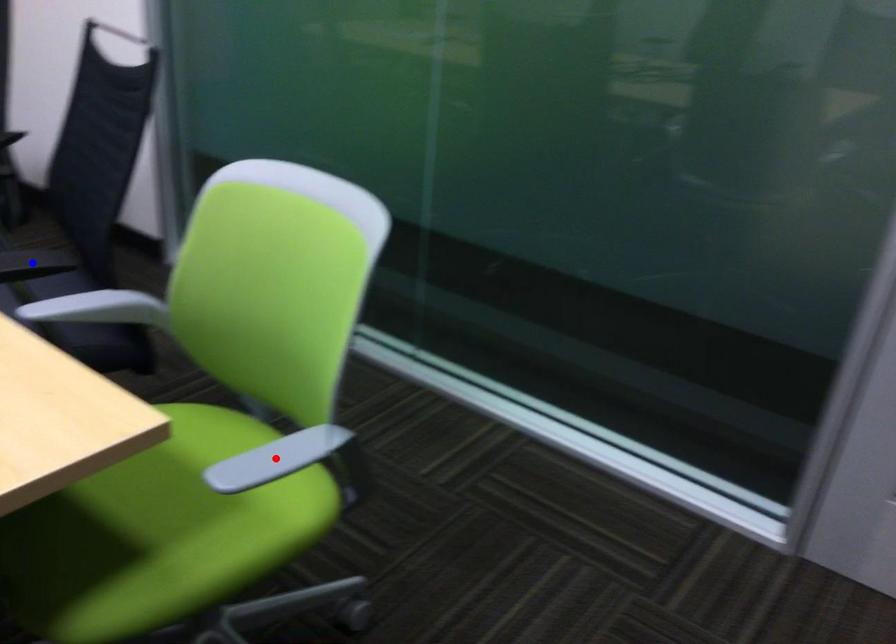
Question: Which of the two points in the image is closer to the camera?

Choices:
 (A) Blue point is closer.
 (B) Red point is closer.

Answer: (B)